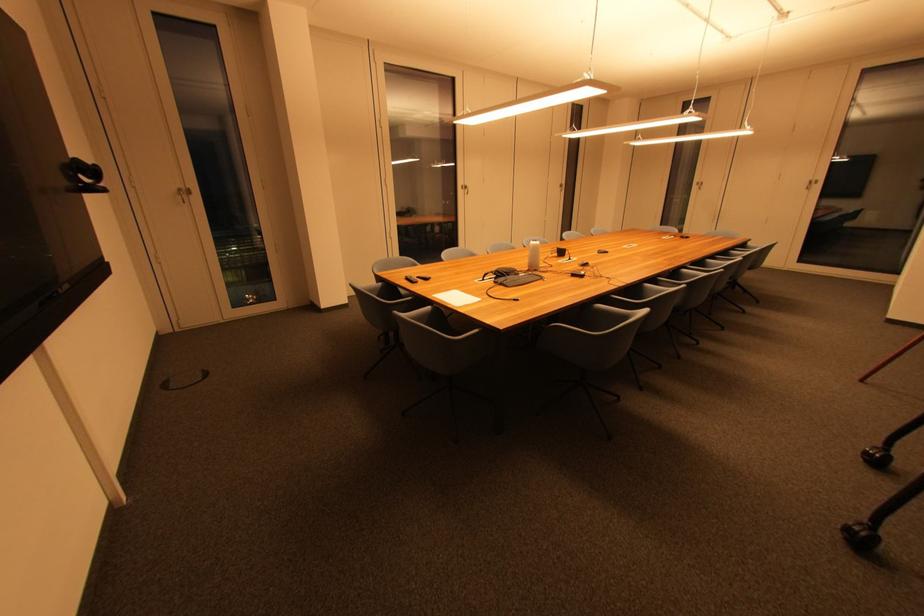
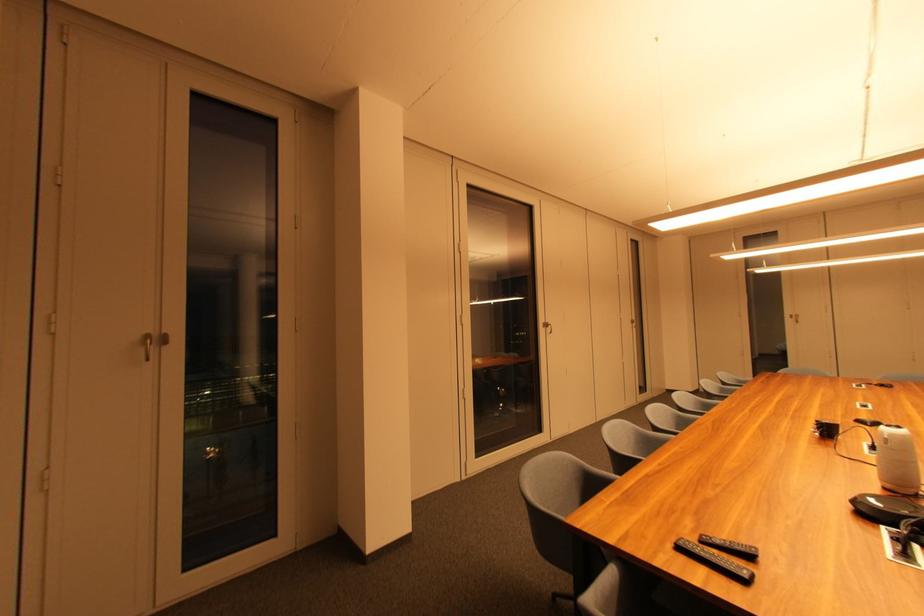
The images are taken continuously from a first-person perspective. In which direction are you moving?

The cameraman walked toward left, forward.